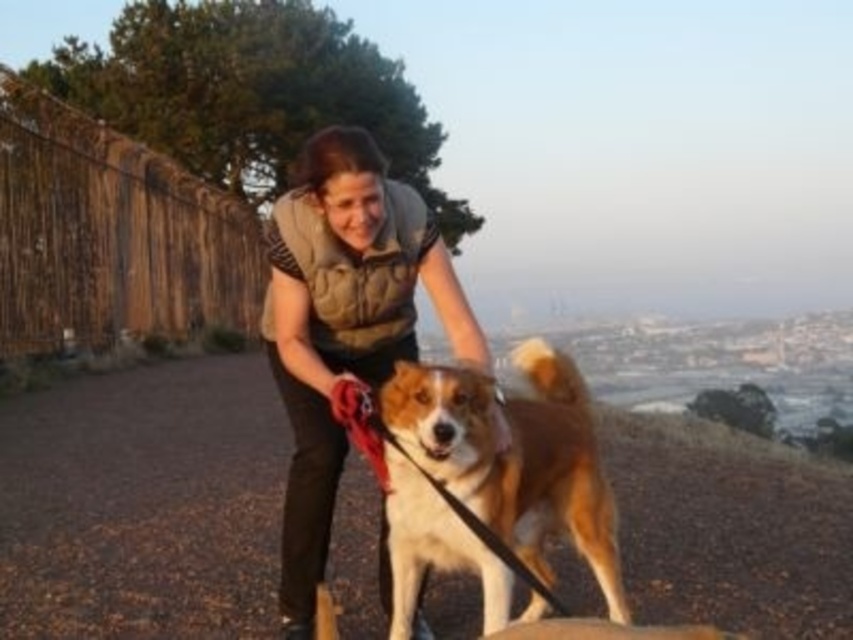
Does brown fur dog at center have a smaller size compared to matte brown vest at center?

Incorrect, brown fur dog at center is not smaller in size than matte brown vest at center.

Does brown fur dog at center come behind matte brown vest at center?

Yes, brown fur dog at center is behind matte brown vest at center.

The width and height of the screenshot is (853, 640). Find the location of `brown fur dog at center`. brown fur dog at center is located at coordinates (143, 502).

Looking at this image, is brown fur dog at center above brown and white fur at center?

No, brown fur dog at center is not above brown and white fur at center.

Between brown fur dog at center and brown and white fur at center, which one has less height?

With less height is brown and white fur at center.

Is point (70, 420) positioned before point (535, 436)?

No, (70, 420) is behind (535, 436).

Where is `brown fur dog at center`? brown fur dog at center is located at coordinates pyautogui.click(x=143, y=502).

Which is above, matte brown vest at center or brown and white fur at center?

matte brown vest at center is above.

Is point (335, 144) farther from camera compared to point (476, 493)?

Yes, it is.

Identify the location of matte brown vest at center. This screenshot has height=640, width=853. (343, 324).